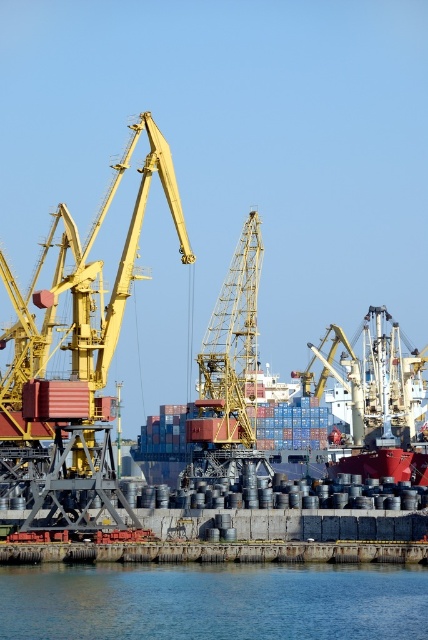
You are a port supervisor who needs to ensure safety distances between the red matte container ship at center and the nearest crane. The minimum safe distance required is 150 meters. Can you confirm if the current distance meets the safety requirement?

The red matte container ship at center is 203.68 meters from camera, which exceeds the minimum safe distance of 150 meters. Therefore, the current distance meets the safety requirement.

You are a port engineer assessing the height of the red matte container ship at center and the yellow metallic crane at center. Which one has a greater height?

The yellow metallic crane at center is taller than the red matte container ship at center.

You are standing at the port and want to determine which of the two points, point (305, 576) or point (217, 332), is nearer to you. Based on the scene, which point is closer?

Point (305, 576) is closer to the viewer than point (217, 332).